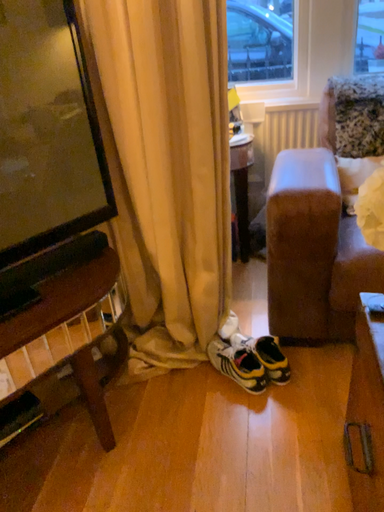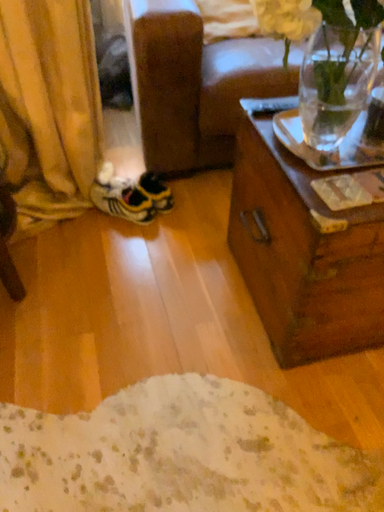
Question: How did the camera likely rotate when shooting the video?

Choices:
 (A) rotated downward
 (B) rotated upward

Answer: (A)